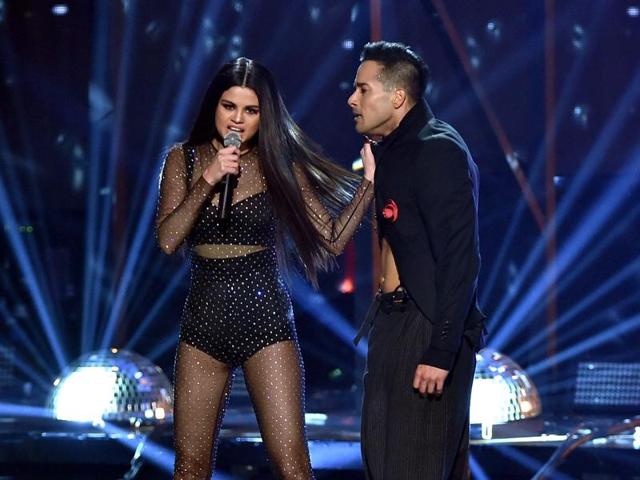
Locate an element on the screen. The height and width of the screenshot is (480, 640). two sets of beams of lights shooting from the disco balls is located at coordinates (502, 336), (113, 325).